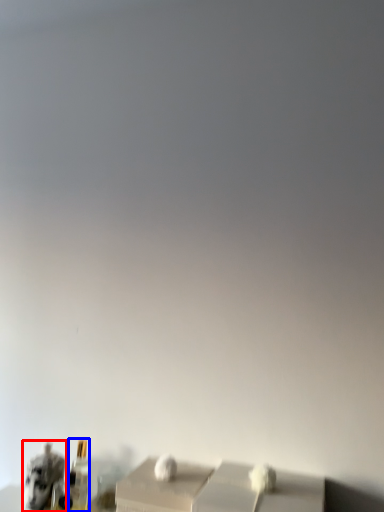
Question: Which point is closer to the camera, animal (highlighted by a red box) or bottle (highlighted by a blue box)?

Choices:
 (A) animal
 (B) bottle

Answer: (A)